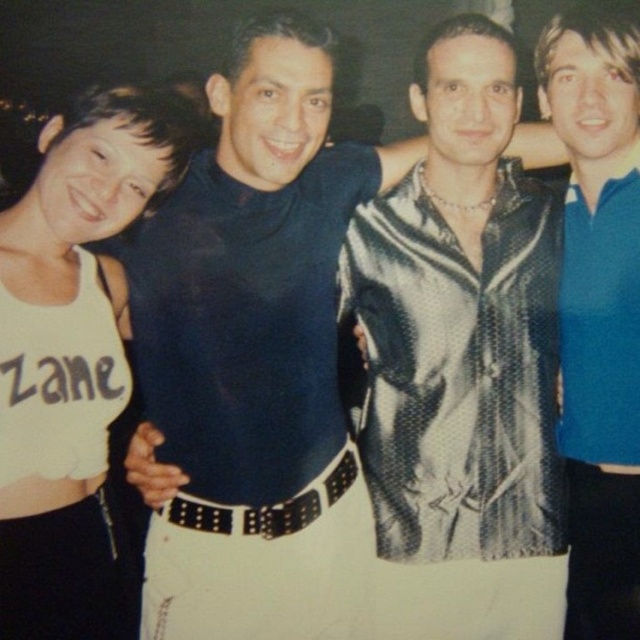
You are standing in front of the group photo and want to touch the two points marked in the image. Which point, point (492, 390) or point (568, 51), is closer to you?

Point (492, 390) is closer to the viewer than point (568, 51).

You are a photographer adjusting the camera settings. You notice two clothing items in the frame, the matte black turtleneck at center and the blue smooth polo shirt at right. Which clothing item is positioned higher in the image?

The matte black turtleneck at center is located above the blue smooth polo shirt at right, so it is positioned higher in the image.

You are trying to decide which clothing item to choose for an event. Based on the image, which clothing item is smaller in size between the shiny metallic jacket at center and the blue smooth polo shirt at right?

The shiny metallic jacket at center is smaller than the blue smooth polo shirt at right, so the shiny metallic jacket at center would be the smaller option.